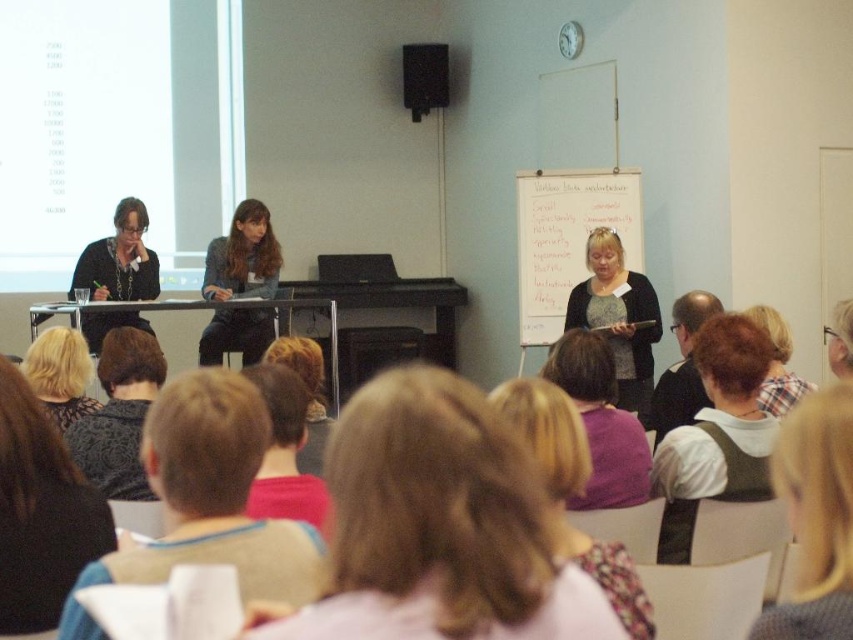
You are a person in the classroom who needs to pass a note to someone. You are currently standing next to the white shirt with brown vest at lower right. The person you need to reach is sitting by the dark gray sweater at lower left. Can you walk directly to them without stepping over any chairs or obstacles? The chairs are spaced 2 feet apart.

The distance between the white shirt with brown vest at lower right and the dark gray sweater at lower left is 6.23 feet. Since the chairs are spaced 2 feet apart, there should be enough space to walk directly to them without stepping over chairs or obstacles.

You are an observer in the classroom. You notice two people wearing the knitted sweater at center and the plaid shirt at lower right. Which person is sitting to the left of the other?

The knitted sweater at center is positioned on the left side of plaid shirt at lower right, so the person wearing the knitted sweater at center is sitting to the left of the person in the plaid shirt at lower right.